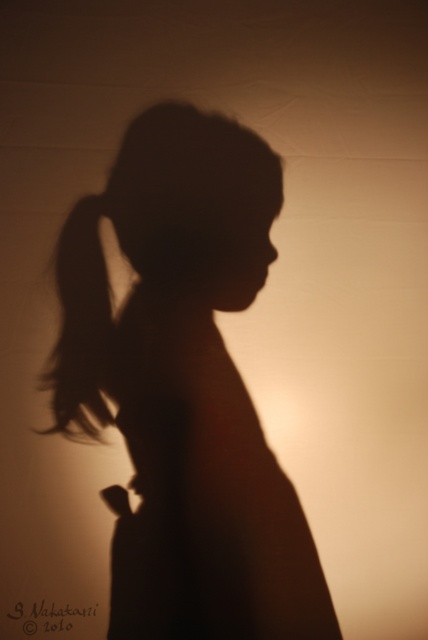
Between point (171, 365) and point (88, 241), which one is positioned behind?

The point (171, 365) is behind.

Is point (139, 156) farther from viewer compared to point (76, 416)?

That is False.

Identify the location of silhouette figure at center. The width and height of the screenshot is (428, 640). (184, 387).